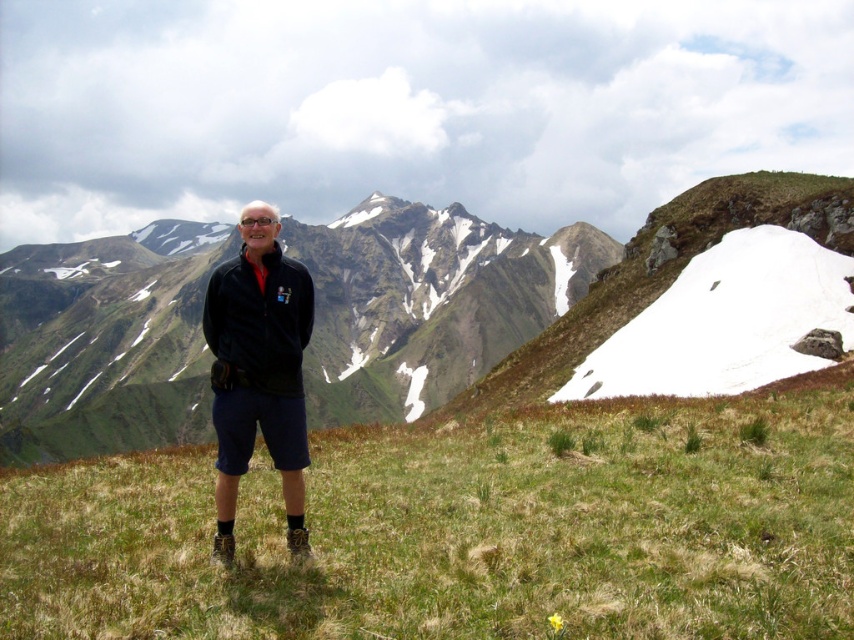
You are a photographer trying to capture the person in the scene. Since the green grassy hillside at center and the black matte jacket at center are both in the frame, can you determine which one will appear bigger in your photo?

The green grassy hillside at center will appear bigger in the photo because it has a larger size compared to the black matte jacket at center.